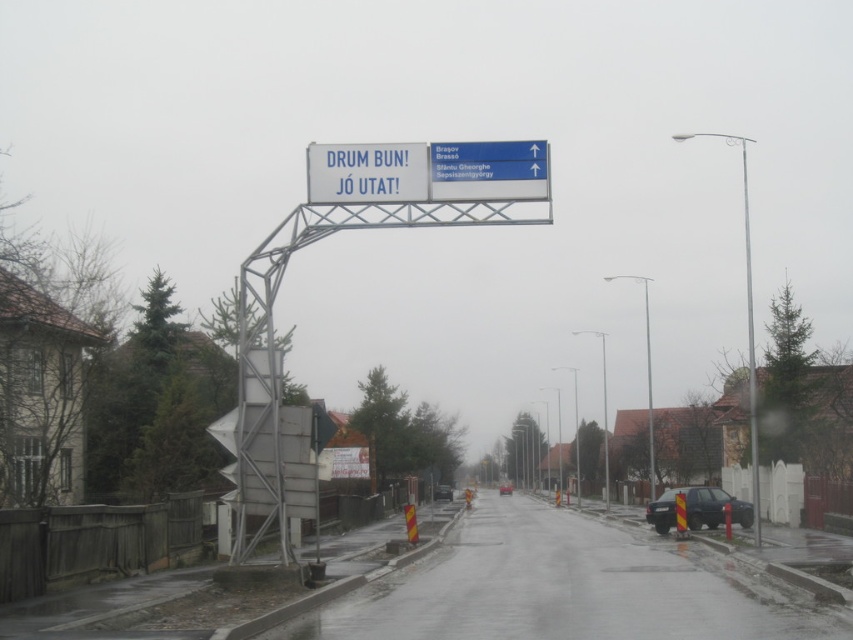
Can you confirm if white plastic sign at upper center is positioned to the right of blue plastic sign at upper center?

No, white plastic sign at upper center is not to the right of blue plastic sign at upper center.

Is point (331, 180) closer to viewer compared to point (444, 176)?

No.

This screenshot has height=640, width=853. I want to click on white plastic sign at upper center, so click(x=366, y=172).

How much distance is there between blue plastic sign at upper center and metallic pole at right?

25.02 meters

Between point (527, 157) and point (752, 424), which one is positioned in front?

Positioned in front is point (527, 157).

Where is `blue plastic sign at upper center`? blue plastic sign at upper center is located at coordinates (488, 170).

You are a GUI agent. You are given a task and a screenshot of the screen. Output one action in this format:
    pyautogui.click(x=<x>, y=<y>)
    Task: Click on the blue plastic sign at upper center
    The image size is (853, 640).
    Given the screenshot: What is the action you would take?
    (x=488, y=170)

Is point (389, 164) more distant than point (752, 481)?

No, it is not.

Between white plastic sign at upper center and metallic pole at right, which one has less height?

white plastic sign at upper center

Is point (422, 163) positioned behind point (753, 404)?

No, (422, 163) is closer to viewer.

Locate an element on the screen. Image resolution: width=853 pixels, height=640 pixels. white plastic sign at upper center is located at coordinates (366, 172).